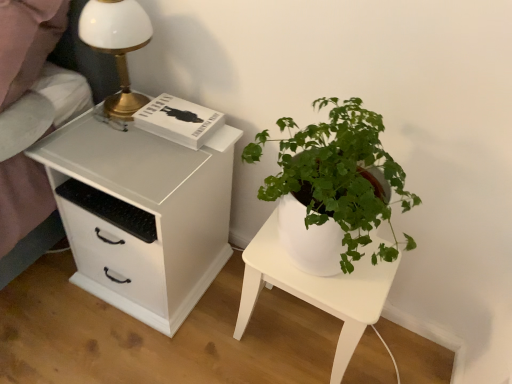
Where is `free space to the left of white glossy nightstand at lower right`? free space to the left of white glossy nightstand at lower right is located at coordinates (211, 336).